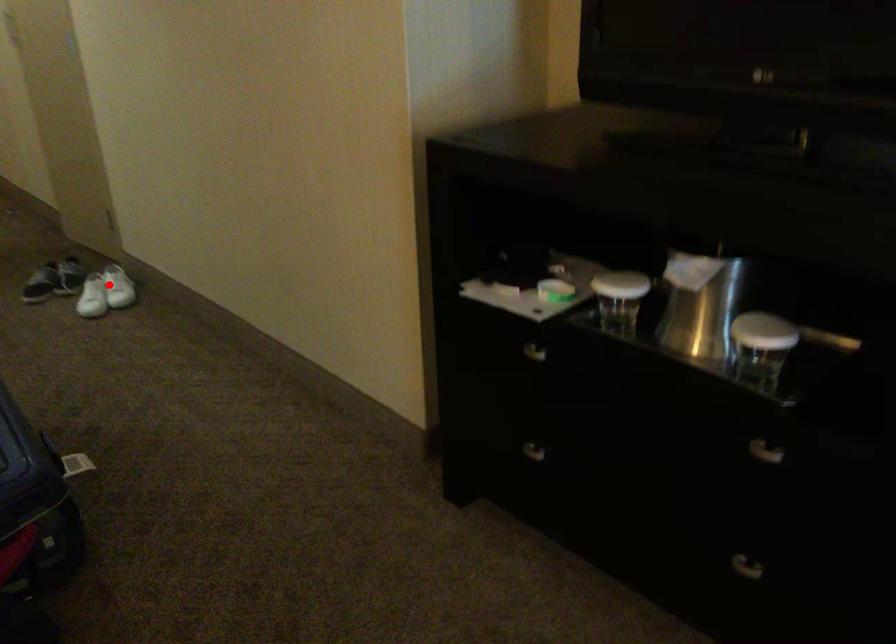
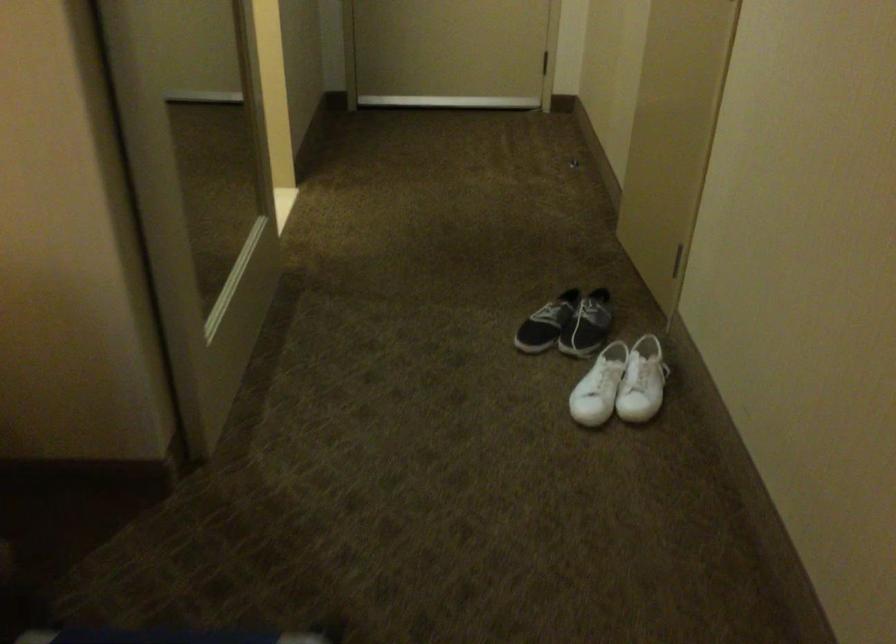
Question: I am providing you with two images of the same scene from different viewpoints. Given a red point in image1, look at the same physical point in image2. Is it:

Choices:
 (A) Closer to the viewpoint
 (B) Farther from the viewpoint

Answer: (A)